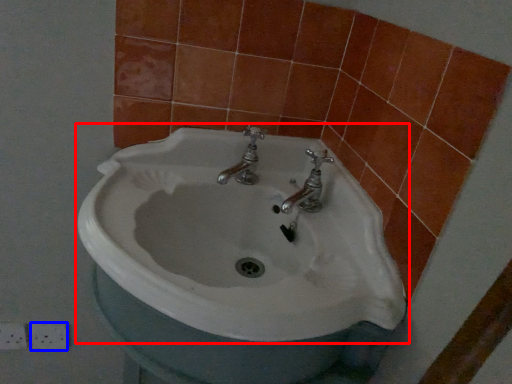
Question: Which object appears farthest to the camera in this image, sink (highlighted by a red box) or ceramic tile (highlighted by a blue box)?

Choices:
 (A) sink
 (B) ceramic tile

Answer: (B)